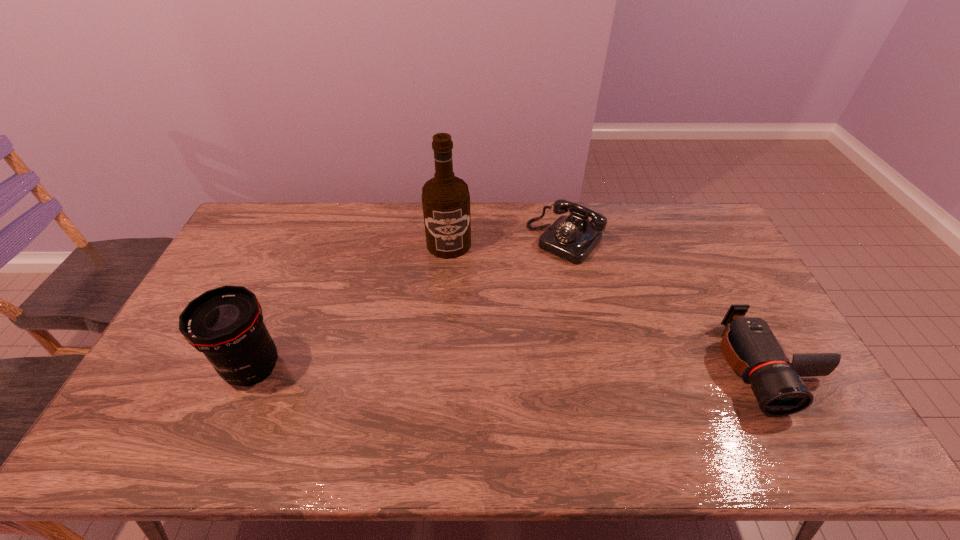
Image resolution: width=960 pixels, height=540 pixels. Identify the location of the leftmost object. (226, 323).

The width and height of the screenshot is (960, 540). Find the location of `the second tallest object`. the second tallest object is located at coordinates (226, 323).

Locate an element on the screen. the shortest object is located at coordinates (749, 346).

The image size is (960, 540). What are the coordinates of `the rightmost object` in the screenshot? It's located at (749, 346).

Where is `telephone`? This screenshot has width=960, height=540. telephone is located at coordinates (572, 238).

Identify the location of alcohol. This screenshot has height=540, width=960. (445, 198).

Find the location of `the second object from left to right`. the second object from left to right is located at coordinates (445, 198).

What are the coordinates of `vacant space located on the back of the third shortest object` in the screenshot? It's located at (271, 326).

Find the location of a particular element. vacant position located 0.400m on the dial of the telephone is located at coordinates (476, 335).

Locate an element on the screen. The height and width of the screenshot is (540, 960). vacant space located on the dial of the telephone is located at coordinates (493, 316).